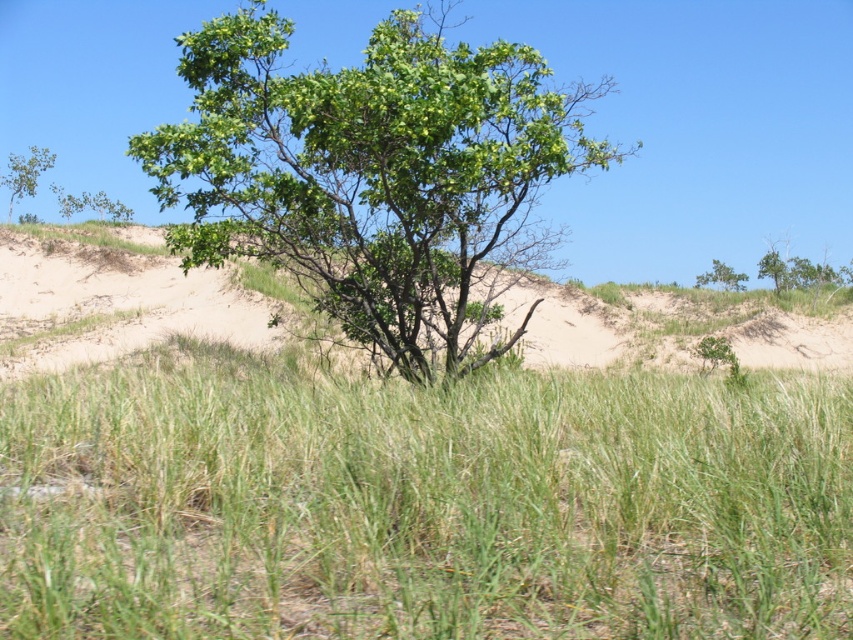
Can you confirm if green leafy tree at center is positioned to the right of green leafy tree at upper left?

Correct, you'll find green leafy tree at center to the right of green leafy tree at upper left.

Is point (457, 100) farther from camera compared to point (21, 154)?

No, it is in front of (21, 154).

Identify the location of green leafy tree at center. This screenshot has width=853, height=640. (374, 177).

Which is more to the left, green grassy at center or green leafy tree at upper right?

green grassy at center is more to the left.

Find the location of a particular element. The height and width of the screenshot is (640, 853). green grassy at center is located at coordinates (421, 502).

You are a GUI agent. You are given a task and a screenshot of the screen. Output one action in this format:
    pyautogui.click(x=<x>, y=<y>)
    Task: Click on the green grassy at center
    
    Given the screenshot: What is the action you would take?
    point(421,502)

Who is positioned more to the left, green leafy tree at upper left or green leafy tree at upper right?

green leafy tree at upper left is more to the left.

Is point (22, 180) positioned after point (740, 289)?

No, (22, 180) is in front of (740, 289).

Where is `green leafy tree at upper left`? Image resolution: width=853 pixels, height=640 pixels. green leafy tree at upper left is located at coordinates (24, 173).